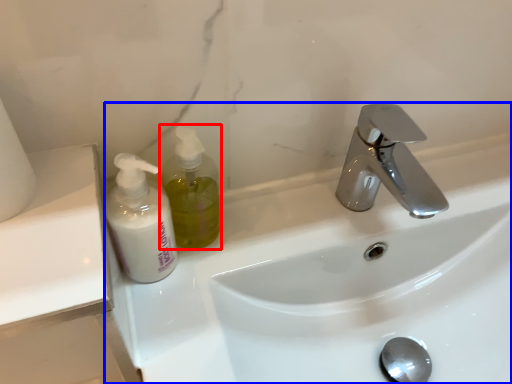
Question: Which object is further to the camera taking this photo, soap dispenser (highlighted by a red box) or sink (highlighted by a blue box)?

Choices:
 (A) soap dispenser
 (B) sink

Answer: (A)